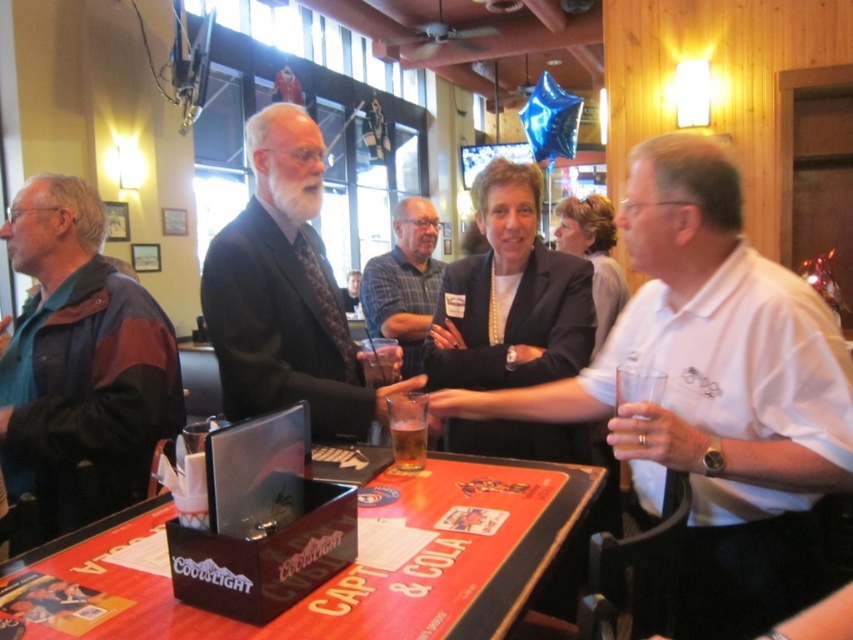
Is point (688, 448) less distant than point (404, 442)?

Yes, it is in front of point (404, 442).

Does white cotton shirt at center have a lesser width compared to translucent glass beer at table center?

Incorrect, white cotton shirt at center's width is not less than translucent glass beer at table center's.

Locate an element on the screen. This screenshot has height=640, width=853. white cotton shirt at center is located at coordinates (712, 390).

The height and width of the screenshot is (640, 853). What do you see at coordinates (712, 390) in the screenshot?
I see `white cotton shirt at center` at bounding box center [712, 390].

Does point (718, 422) lie behind point (270, 381)?

No, (718, 422) is closer to viewer.

Measure the distance between point (663, 481) and camera.

They are 1.43 meters apart.

The height and width of the screenshot is (640, 853). I want to click on white cotton shirt at center, so click(x=712, y=390).

Who is lower down, white cotton shirt at center or teal leather jacket at left?

Positioned lower is white cotton shirt at center.

Does white cotton shirt at center appear on the left side of teal leather jacket at left?

In fact, white cotton shirt at center is to the right of teal leather jacket at left.

Does point (808, 342) come behind point (67, 218)?

No, (808, 342) is in front of (67, 218).

Locate an element on the screen. white cotton shirt at center is located at coordinates (712, 390).